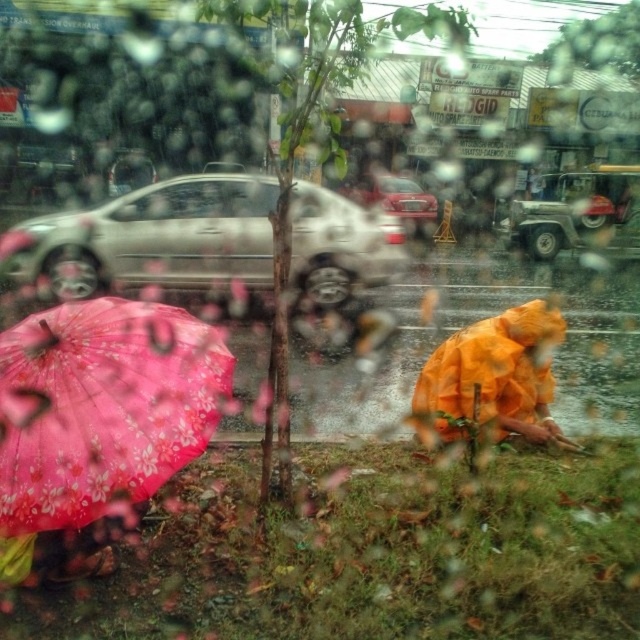
Question: Does orange waterproof coat at lower right appear on the left side of shiny red sedan at center?

Choices:
 (A) no
 (B) yes

Answer: (B)

Question: Considering the relative positions of satin silver car at left and orange waterproof coat at lower right in the image provided, where is satin silver car at left located with respect to orange waterproof coat at lower right?

Choices:
 (A) left
 (B) right

Answer: (A)

Question: Which object is positioned closest to the metallic silver jeep at right?

Choices:
 (A) satin silver car at left
 (B) orange waterproof coat at lower right

Answer: (A)

Question: Which object is positioned closest to the metallic silver jeep at right?

Choices:
 (A) pink floral fabric umbrella at lower left
 (B) shiny red sedan at center

Answer: (B)

Question: Where is pink floral fabric umbrella at lower left located in relation to metallic silver jeep at right in the image?

Choices:
 (A) left
 (B) right

Answer: (A)

Question: Which point is closer to the camera taking this photo?

Choices:
 (A) (422, 232)
 (B) (3, 499)
 (C) (88, 212)

Answer: (B)